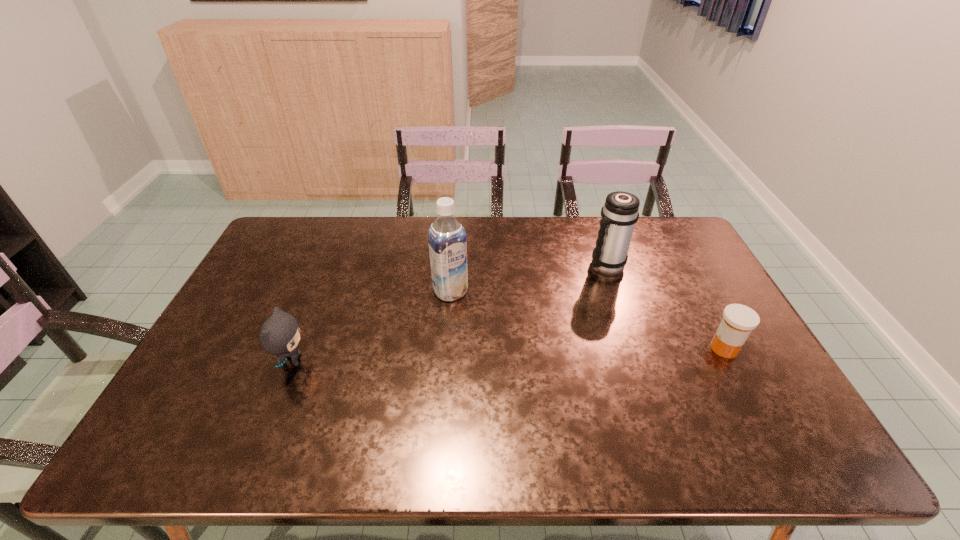
Where is `vacant space situated 0.300m on the label of the second farthest object`? This screenshot has width=960, height=540. vacant space situated 0.300m on the label of the second farthest object is located at coordinates (509, 373).

The height and width of the screenshot is (540, 960). What are the coordinates of `free spot located 0.070m on the label of the second farthest object` in the screenshot? It's located at (468, 317).

Find the location of a particular element. vacant space located 0.150m on the label of the second farthest object is located at coordinates (482, 335).

I want to click on vacant space located on the side with the handle of the second tallest object, so click(572, 295).

At what (x,y) coordinates should I click in order to perform the action: click on vacant area located 0.320m on the side with the handle of the second tallest object. Please return your answer as a coordinate pair (x, y). Image resolution: width=960 pixels, height=540 pixels. Looking at the image, I should click on (538, 328).

This screenshot has width=960, height=540. What are the coordinates of `free point located 0.250m on the side with the handle of the second tallest object` in the screenshot? It's located at (552, 314).

Where is `object positioned at the far edge`? This screenshot has height=540, width=960. object positioned at the far edge is located at coordinates (619, 214).

Where is `object present at the near edge`? This screenshot has height=540, width=960. object present at the near edge is located at coordinates (280, 334).

Locate an element on the screen. object that is at the right edge is located at coordinates (738, 321).

In the image, there is a desktop. In order to click on blank space at the far edge in this screenshot , I will do `click(550, 251)`.